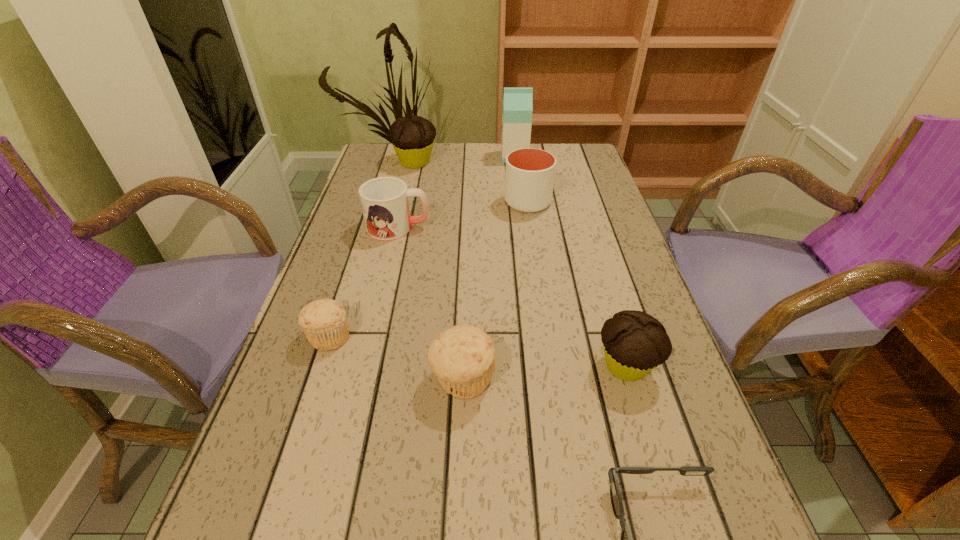
The image size is (960, 540). What are the coordinates of `the second shortest object` in the screenshot? It's located at (324, 322).

Identify the location of the left beige muffin. This screenshot has height=540, width=960. (324, 322).

The image size is (960, 540). I want to click on vacant region located on the left of the tallest object, so click(462, 157).

Locate an element on the screen. The height and width of the screenshot is (540, 960). free location located on the back of the farther chocolate muffin is located at coordinates (420, 143).

Locate an element on the screen. This screenshot has width=960, height=540. vacant position located on the right of the cup is located at coordinates (612, 202).

Where is `vacant area situated 0.400m on the side of the mug with the handle`? The image size is (960, 540). vacant area situated 0.400m on the side of the mug with the handle is located at coordinates (582, 227).

Find the location of a particular element. free point located on the front of the bigger beige muffin is located at coordinates (459, 471).

Image resolution: width=960 pixels, height=540 pixels. Identify the location of vacant space located on the back of the rightmost muffin. (598, 271).

Find the location of a particular element. free space located 0.300m on the front of the shortest muffin is located at coordinates (268, 522).

Locate an element on the screen. The image size is (960, 540). milk carton that is at the far edge is located at coordinates click(517, 110).